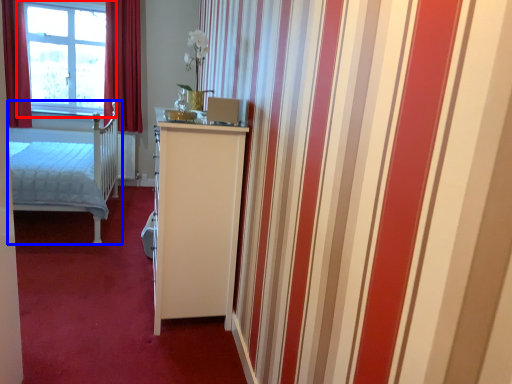
Question: Which object is further to the camera taking this photo, window (highlighted by a red box) or bed (highlighted by a blue box)?

Choices:
 (A) window
 (B) bed

Answer: (A)